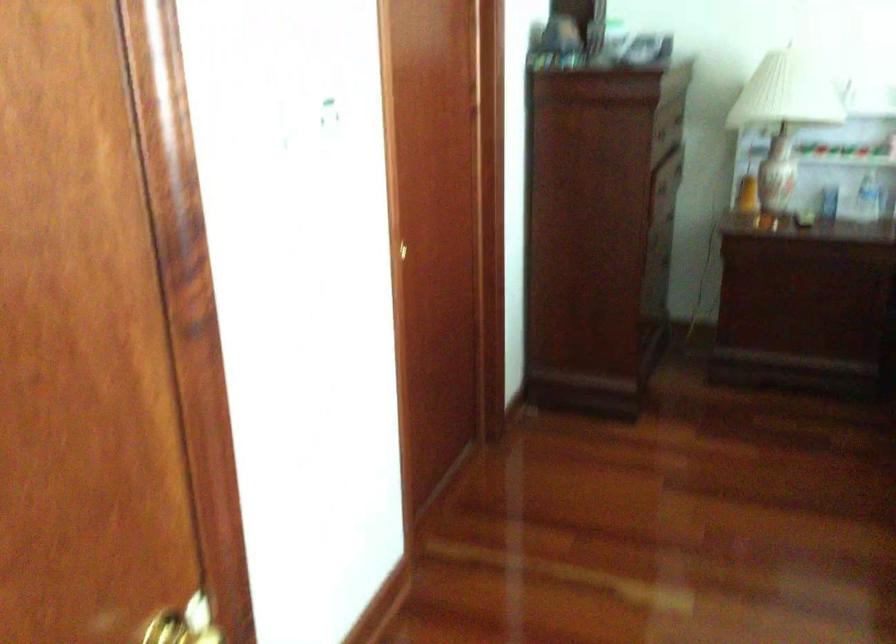
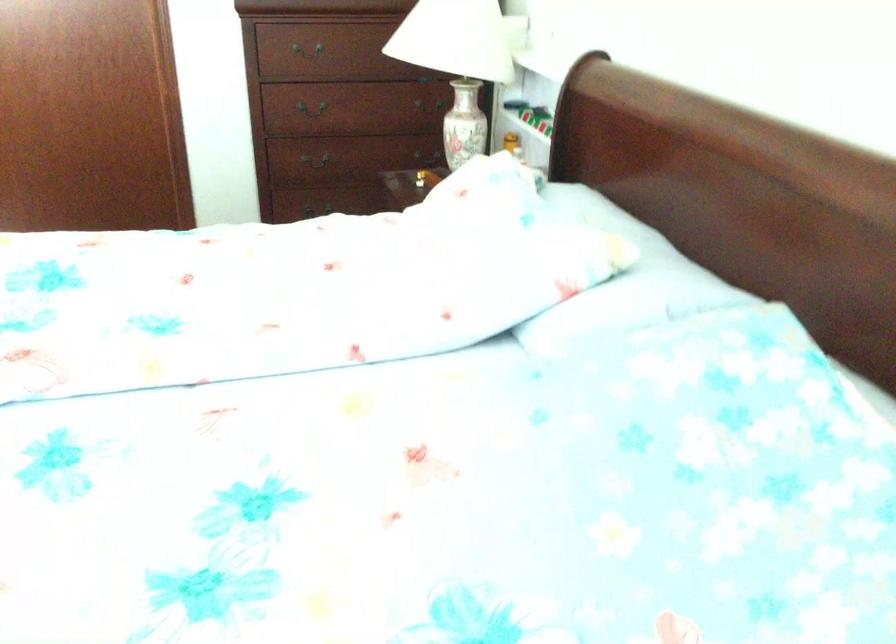
Find the pixel in the second image that matches (600,289) in the first image.

(321, 200)